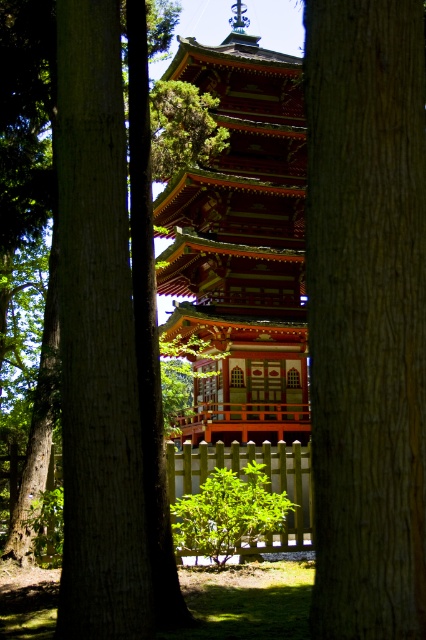
Question: Which point is closer to the camera?

Choices:
 (A) brown rough tree trunk at center
 (B) shiny lacquered pagoda at center

Answer: (A)

Question: Which point is closer to the camera?

Choices:
 (A) (146, 550)
 (B) (291, 289)

Answer: (A)

Question: Does smooth brown tree trunk at center appear over shiny lacquered pagoda at center?

Choices:
 (A) yes
 (B) no

Answer: (B)

Question: Observing the image, what is the correct spatial positioning of smooth brown tree trunk at center in reference to shiny lacquered pagoda at center?

Choices:
 (A) below
 (B) above

Answer: (A)

Question: Is brown rough tree trunk at center to the left of shiny lacquered pagoda at center from the viewer's perspective?

Choices:
 (A) yes
 (B) no

Answer: (B)

Question: Among these points, which one is farthest from the camera?

Choices:
 (A) (379, 620)
 (B) (80, 625)

Answer: (B)